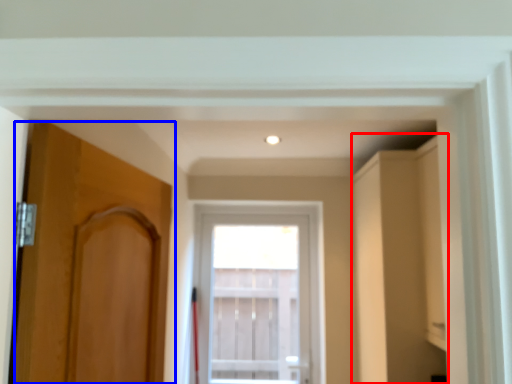
Question: Which of the following is the closest to the observer, cabinetry (highlighted by a red box) or door (highlighted by a blue box)?

Choices:
 (A) cabinetry
 (B) door

Answer: (B)